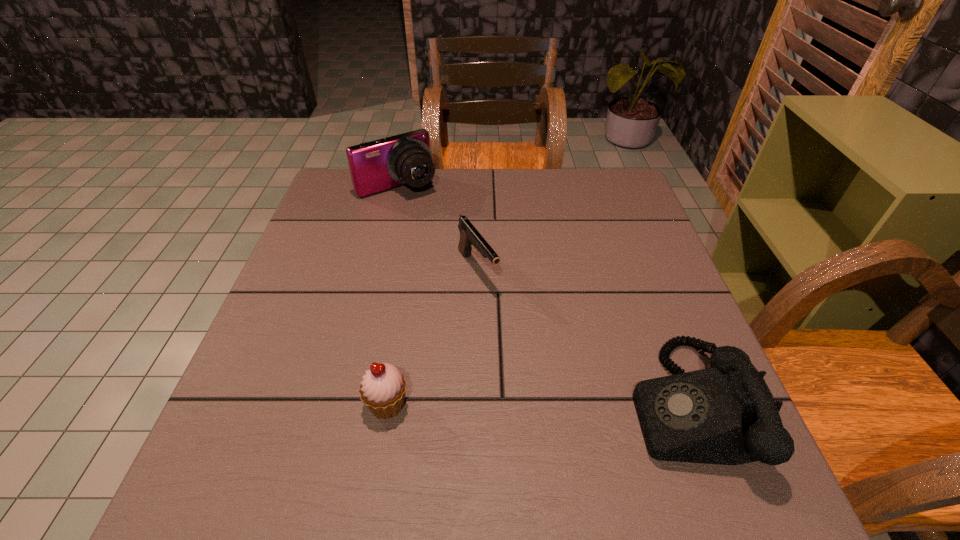
This screenshot has width=960, height=540. In order to click on free space between the cupcake and the farthest object in this screenshot , I will do `click(393, 296)`.

This screenshot has height=540, width=960. In order to click on vacant region between the camera and the cupcake in this screenshot , I will do `click(393, 296)`.

Find the location of a particular element. Image resolution: width=960 pixels, height=540 pixels. free spot between the third nearest object and the camera is located at coordinates (438, 228).

The image size is (960, 540). Find the location of `vacant point located between the pistol and the telephone`. vacant point located between the pistol and the telephone is located at coordinates (581, 337).

At what (x,y) coordinates should I click in order to perform the action: click on free space between the pistol and the cupcake. Please return your answer as a coordinate pair (x, y). Looking at the image, I should click on (433, 337).

The height and width of the screenshot is (540, 960). Identify the location of unoccupied position between the cupcake and the camera. (393, 296).

Where is `unoccupied position between the telephone and the cupcake`? The width and height of the screenshot is (960, 540). unoccupied position between the telephone and the cupcake is located at coordinates (536, 404).

Locate an element on the screen. The image size is (960, 540). object that can be found as the second closest to the third object from left to right is located at coordinates (383, 388).

Locate an element on the screen. The image size is (960, 540). object identified as the third closest to the pistol is located at coordinates (726, 414).

Image resolution: width=960 pixels, height=540 pixels. Find the location of `free spot that satisfies the following two spatial constraints: 1. on the front side of the camera; 2. on the right side of the pistol`. free spot that satisfies the following two spatial constraints: 1. on the front side of the camera; 2. on the right side of the pistol is located at coordinates (378, 270).